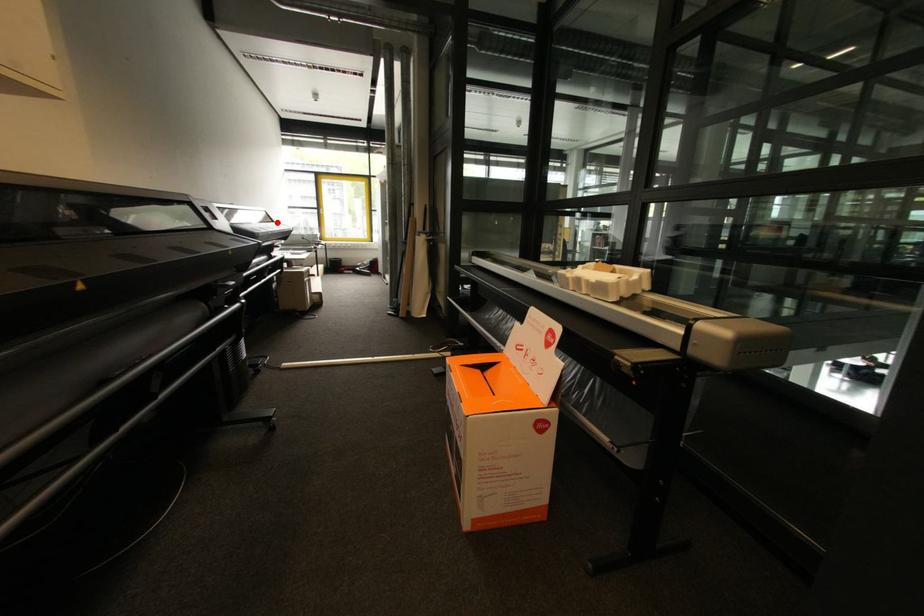
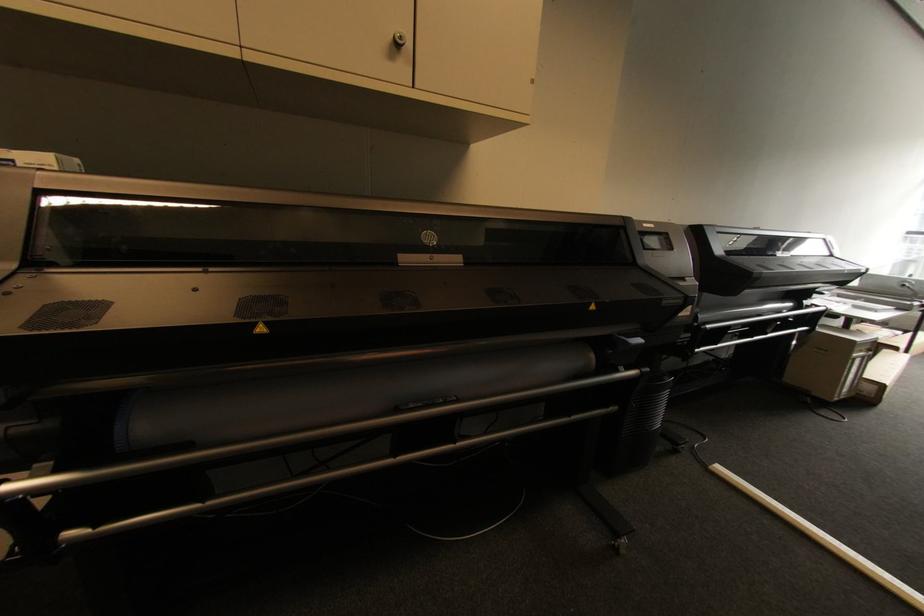
Question: A red point is marked in image1. In image2, is the corresponding 3D point closer to the camera or farther? Reply with the corresponding letter.

Choices:
 (A) The corresponding 3D point is closer.
 (B) The corresponding 3D point is farther.

Answer: (B)